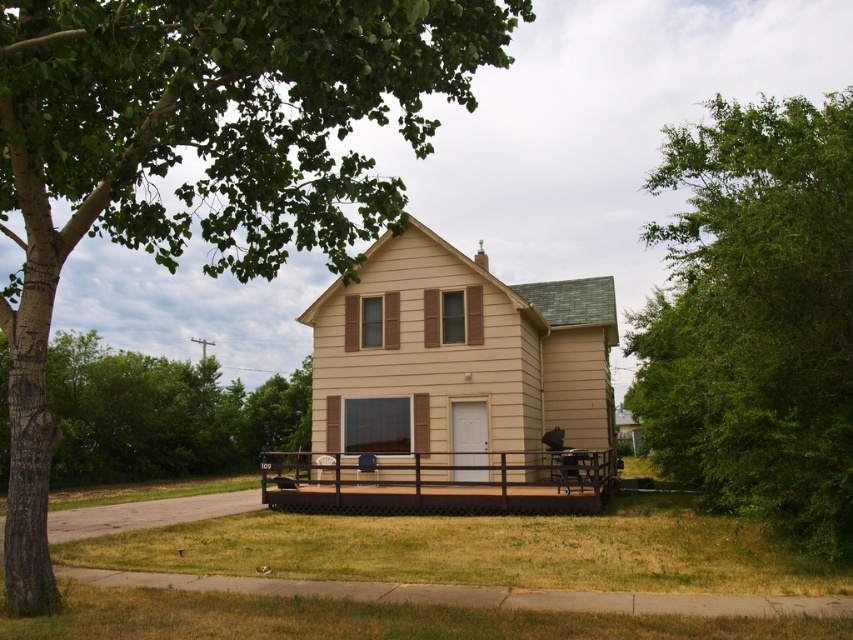
Does point (682, 378) come in front of point (425, 525)?

No, it is behind (425, 525).

Looking at this image, between green leafy tree at right and brown wood deck at lower center, which one has less height?

brown wood deck at lower center

Locate an element on the screen. The height and width of the screenshot is (640, 853). green leafy tree at right is located at coordinates (756, 316).

The height and width of the screenshot is (640, 853). I want to click on green leafy tree at right, so click(x=756, y=316).

This screenshot has height=640, width=853. What do you see at coordinates (199, 156) in the screenshot?
I see `green leafy tree at upper left` at bounding box center [199, 156].

Can you confirm if green leafy tree at upper left is thinner than brown wood porch at lower center?

Incorrect, green leafy tree at upper left's width is not less than brown wood porch at lower center's.

This screenshot has height=640, width=853. Describe the element at coordinates (199, 156) in the screenshot. I see `green leafy tree at upper left` at that location.

This screenshot has height=640, width=853. I want to click on green leafy tree at upper left, so click(x=199, y=156).

Between point (828, 179) and point (581, 504), which one is positioned behind?

The point (581, 504) is behind.

Is green leafy tree at right below brown wood porch at lower center?

No.

Identify the location of green leafy tree at right. (756, 316).